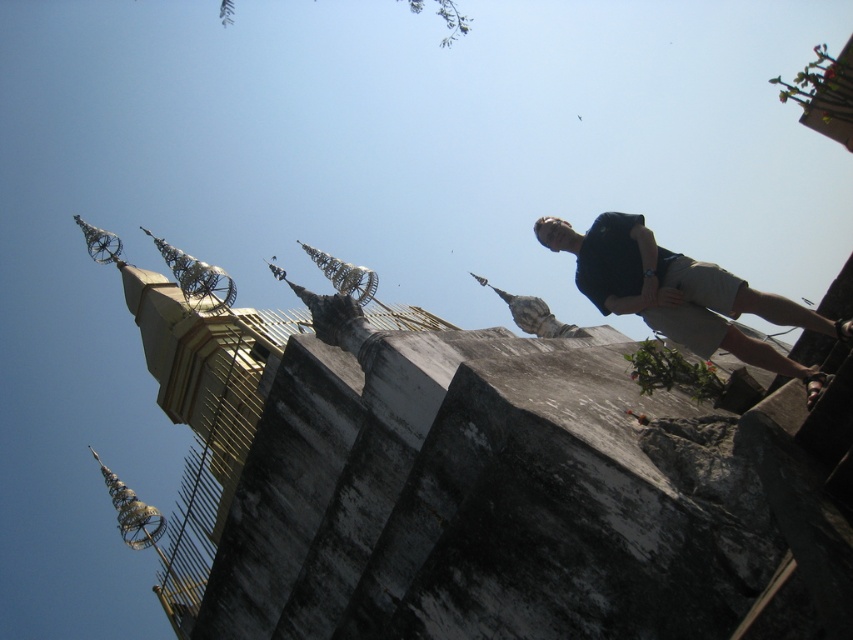
Question: Considering the relative positions of gold metallic spire at upper left and dark blue t-shirt at upper right in the image provided, where is gold metallic spire at upper left located with respect to dark blue t-shirt at upper right?

Choices:
 (A) right
 (B) left

Answer: (B)

Question: Is gold metallic spire at upper left above dark blue t-shirt at upper right?

Choices:
 (A) yes
 (B) no

Answer: (B)

Question: Does gold metallic spire at upper left have a smaller size compared to dark blue t-shirt at upper right?

Choices:
 (A) yes
 (B) no

Answer: (B)

Question: Among these objects, which one is nearest to the camera?

Choices:
 (A) dark blue t-shirt at upper right
 (B) gold metallic spire at upper left

Answer: (A)

Question: Among these objects, which one is farthest from the camera?

Choices:
 (A) gold metallic spire at upper left
 (B) dark blue t-shirt at upper right

Answer: (A)